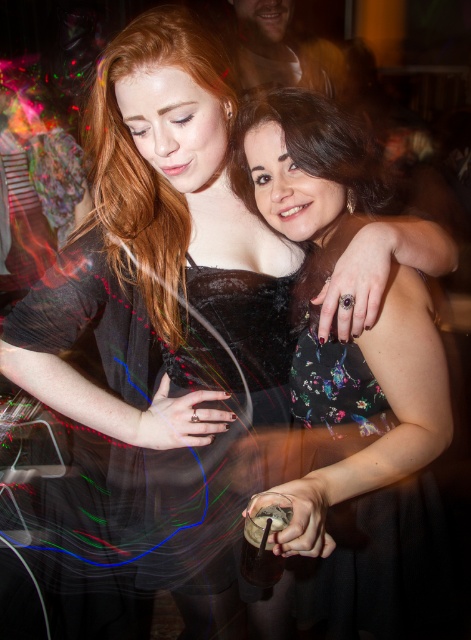
You are at a party and want to take a photo with both the black floral dress at center and the black sheer dress at center. To ensure both are fully visible in the frame, which dress should you position closer to the camera?

The black sheer dress at center should be positioned closer to the camera because it is shorter than the black floral dress at center, which is taller. This way, both will be fully visible in the frame.

You are a photographer who wants to ensure both dresses are visible in the photo. Since the black floral dress at center and the black sheer dress at center are both in the frame, which one should you focus on to make sure both are in focus?

The black floral dress at center is above the black sheer dress at center, so focusing on the black floral dress at center would ensure both are in focus as it is closer to the camera.

You are planning to wear one of these dresses to an event where there are strict size restrictions. The venue requires that the dress must be no wider than 1 meter. You have both the black floral dress at center and the black sheer dress at center. Which dress should you choose to ensure it meets the venue requirements?

The black floral dress at center is thinner than the black sheer dress at center, so you should choose the black floral dress at center to ensure it meets the venue requirements.